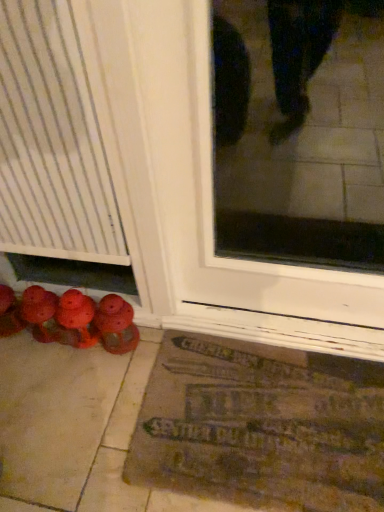
Locate an element on the screen. The height and width of the screenshot is (512, 384). vacant space situated above brown textured mat at lower center (from a real-world perspective) is located at coordinates (260, 420).